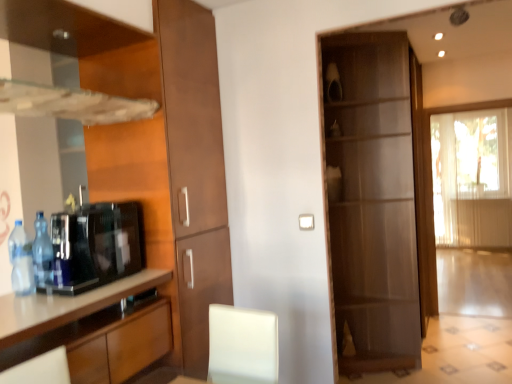
Question: Is translucent fabric curtain at right wider or thinner than blue plastic bottle at left, which is the first bottle in front-to-back order?

Choices:
 (A) thin
 (B) wide

Answer: (B)

Question: Based on their sizes in the image, would you say translucent fabric curtain at right is bigger or smaller than blue plastic bottle at left, which is the first bottle in front-to-back order?

Choices:
 (A) small
 (B) big

Answer: (B)

Question: Which object is the farthest from the translucent fabric curtain at right?

Choices:
 (A) blue plastic bottle at left, which is the first bottle in front-to-back order
 (B) matte brown cabinet at left, which is counted as the first cabinetry, starting from the back
 (C) matte brown cabinet at center
 (D) brown wood cabinet at left, positioned as the first cabinetry in front-to-back order
 (E) blue plastic bottle at left, the second bottle when ordered from front to back

Answer: (E)

Question: Estimate the real-world distances between objects in this image. Which object is farther from the blue plastic bottle at left, marked as the second bottle in a back-to-front arrangement?

Choices:
 (A) matte brown cabinet at center
 (B) blue plastic bottle at left, the second bottle when ordered from front to back
 (C) brown wood cabinet at left, arranged as the second cabinetry when viewed from the back
 (D) black glossy coffee machine at lower left
 (E) translucent fabric curtain at right

Answer: (E)